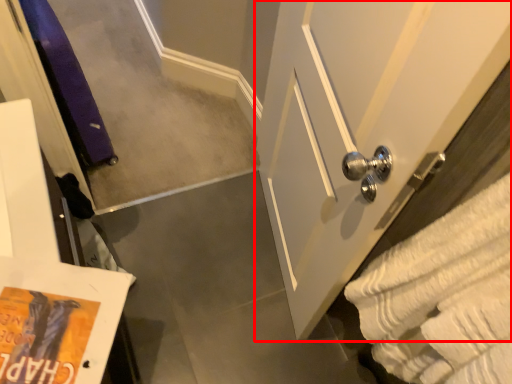
Question: In this image, where is door (annotated by the red box) located relative to bath towel?

Choices:
 (A) left
 (B) right

Answer: (A)